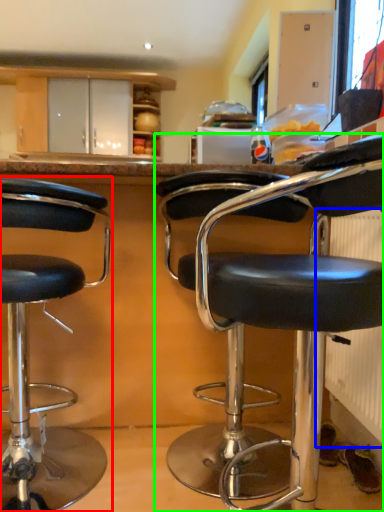
Question: Which is farther away from chair (highlighted by a red box)? radiator (highlighted by a blue box) or chair (highlighted by a green box)?

Choices:
 (A) radiator
 (B) chair

Answer: (A)